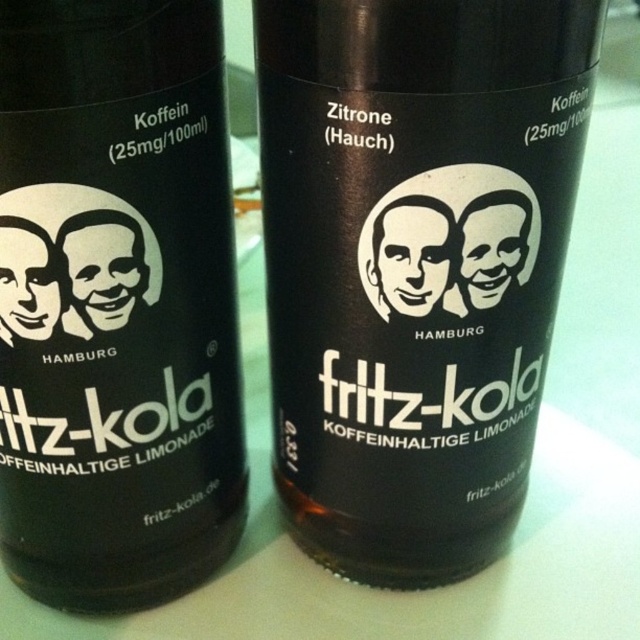
Which is more to the left, black matte bottle at center or brown glass bottle at center?

brown glass bottle at center is more to the left.

Between point (328, 125) and point (19, 547), which one is positioned in front?

Point (328, 125)

Where is `black matte bottle at center`? The image size is (640, 640). black matte bottle at center is located at coordinates (413, 264).